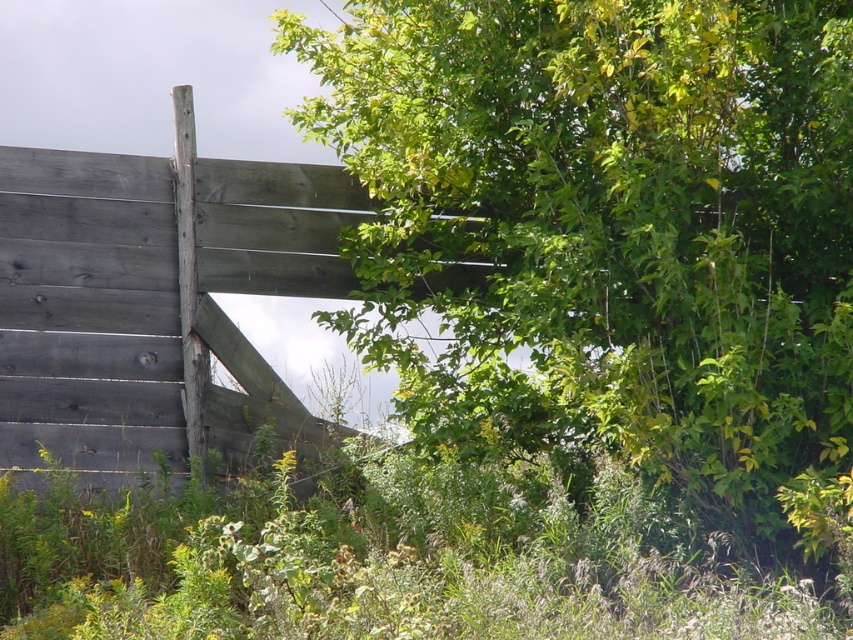
Question: Can you confirm if green leafy tree at upper center is bigger than weathered gray wood at upper left?

Choices:
 (A) no
 (B) yes

Answer: (B)

Question: Which of the following is the closest to the observer?

Choices:
 (A) (648, 460)
 (B) (190, 230)

Answer: (A)

Question: Is green leafy tree at upper center further to camera compared to weathered gray wood at upper left?

Choices:
 (A) no
 (B) yes

Answer: (A)

Question: Is green leafy tree at upper center above weathered gray wood at upper left?

Choices:
 (A) yes
 (B) no

Answer: (A)